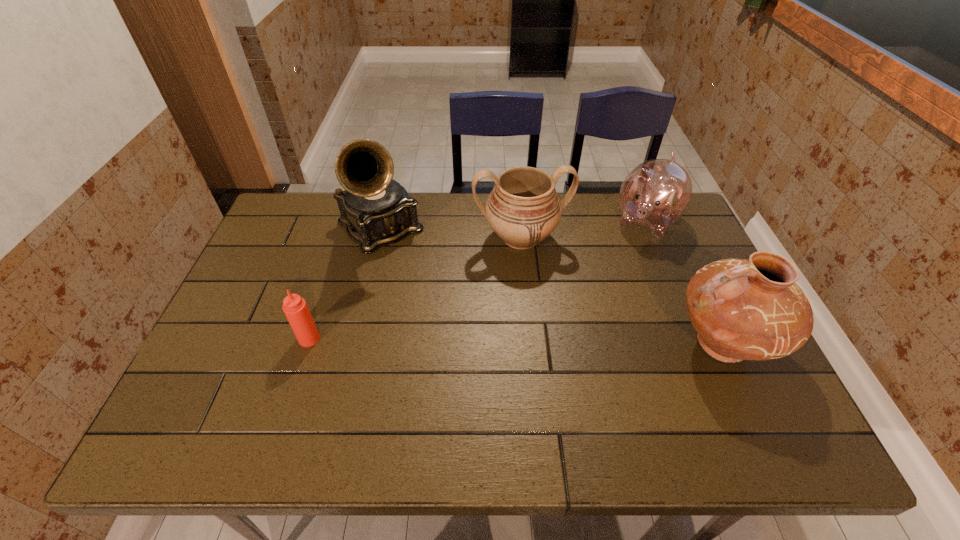
Identify the location of phonograph record present at the far edge. The height and width of the screenshot is (540, 960). (376, 210).

Where is `object that is at the near edge`? This screenshot has height=540, width=960. object that is at the near edge is located at coordinates (742, 309).

Locate an element on the screen. The image size is (960, 540). pottery positioned at the right edge is located at coordinates (742, 309).

I want to click on piggy bank that is at the right edge, so click(655, 194).

The image size is (960, 540). I want to click on object that is positioned at the far right corner, so click(x=655, y=194).

What are the coordinates of `object that is at the near right corner` in the screenshot? It's located at (742, 309).

At what (x,y) coordinates should I click in order to perform the action: click on blank space at the far edge. Please return your answer as a coordinate pair (x, y). The height and width of the screenshot is (540, 960). Looking at the image, I should click on (609, 237).

Identify the location of free space at the near edge of the desktop. (538, 380).

I want to click on free space at the left edge, so click(x=284, y=251).

The width and height of the screenshot is (960, 540). I want to click on vacant space at the far right corner of the desktop, so (648, 239).